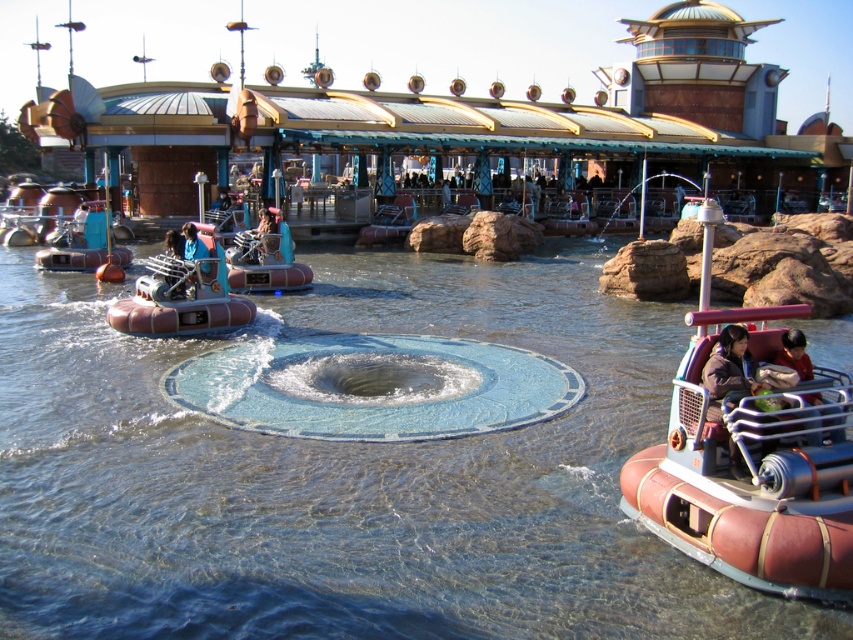
You are a guest at the theme park and want to take a photo of both the brown rubber boat at center and the rustic brown hovercraft at center. Which one should you focus on first to ensure both are in the frame?

You should focus on the brown rubber boat at center first since it is closer to you than the rustic brown hovercraft at center, allowing both to be in the frame by adjusting the camera angle.

You are a visitor at the theme park and want to take a photo of the blue fabric person at center without the matte brown hovercraft at left blocking the view. Is this possible from your current position?

The blue fabric person at center is behind the matte brown hovercraft at left, so you cannot take a photo of the blue fabric person at center without the hovercraft blocking the view from your current position.

You are a safety inspector at the theme park and need to ensure that the brown rubber boat at center is within the required 8 meters safety distance from the camera for monitoring. Based on the scene description, is the boat within the safe distance?

The brown rubber boat at center is 7.13 meters away from the camera, which is within the required 8 meters safety distance for monitoring.